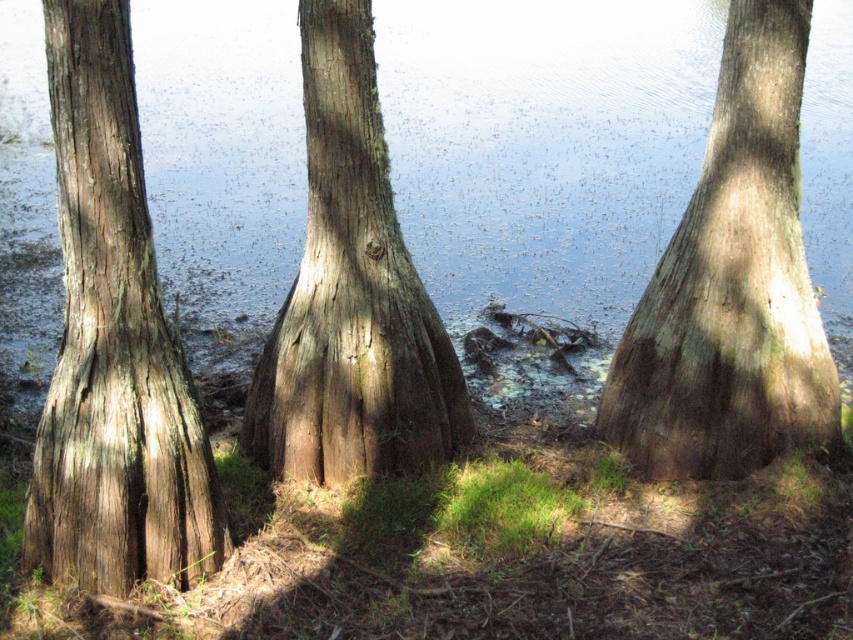
Question: Does smooth brown tree trunk at left lie behind smooth brown tree trunk at center?

Choices:
 (A) yes
 (B) no

Answer: (B)

Question: From the image, what is the correct spatial relationship of clear water at center in relation to smooth brown tree trunk at right?

Choices:
 (A) below
 (B) above

Answer: (B)

Question: Can you confirm if clear water at center is positioned to the left of smooth brown tree trunk at center?

Choices:
 (A) no
 (B) yes

Answer: (A)

Question: Which is nearer to the smooth brown tree trunk at right?

Choices:
 (A) smooth brown tree trunk at center
 (B) clear water at center

Answer: (A)

Question: Which point is farther from the camera taking this photo?

Choices:
 (A) (73, 512)
 (B) (202, 129)
 (C) (364, 35)

Answer: (B)

Question: Which is farther from the smooth brown tree trunk at right?

Choices:
 (A) smooth brown tree trunk at center
 (B) smooth brown tree trunk at left
 (C) clear water at center

Answer: (C)